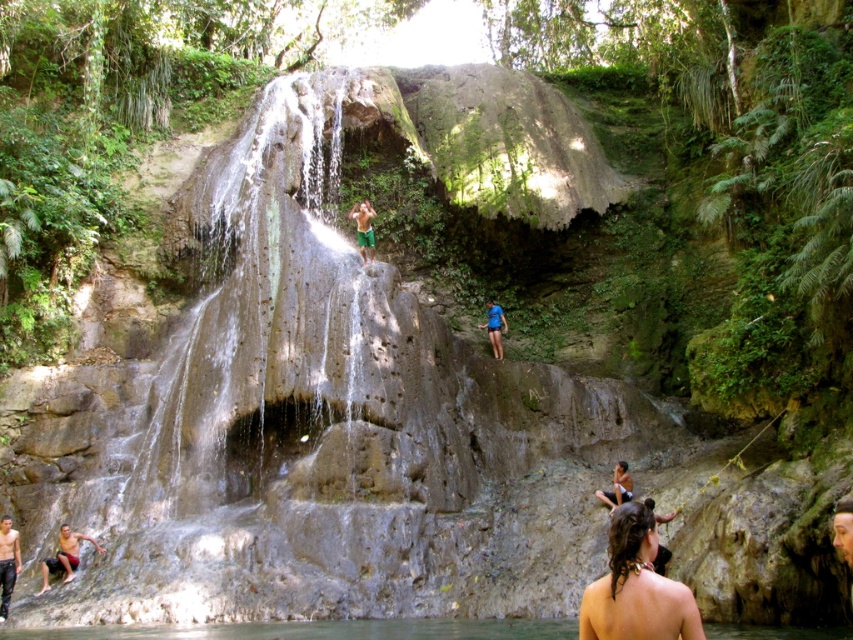
You are standing at the base of the waterfall and notice a person and some shorts in the scene. Which object is shorter in height between the matte skin person at lower left and the blue fabric shorts at lower center?

The matte skin person at lower left is shorter in height compared to the blue fabric shorts at lower center according to the description.

You are standing at the base of the waterfall and see a matte skin person at lower left and blue fabric shorts at lower center. Which object is wider?

The blue fabric shorts at lower center are wider than the matte skin person at lower left.

You are a photographer planning to capture a landscape shot of the waterfall. You notice the green matte shorts at center and the smooth skin person at lower right in your frame. Which object would appear larger in your photo?

The green matte shorts at center would appear larger in the photo because it is bigger than the smooth skin person at lower right according to the description.